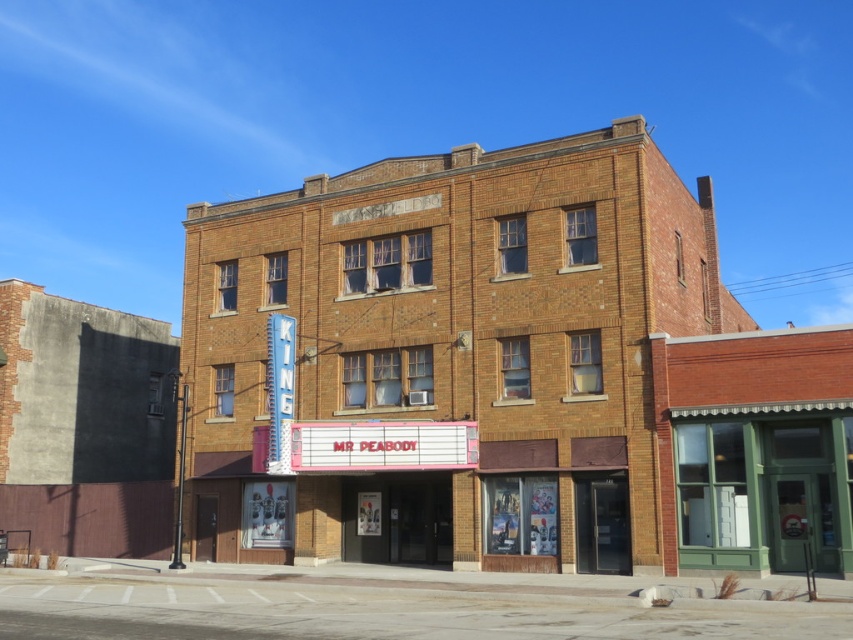
You are a delivery person trying to park your 10 feet long truck in front of the brown brick theater at center and the green painted wood storefront at center. Is there enough space between them to park your truck without blocking either of them?

The brown brick theater at center and green painted wood storefront at center are 15.24 feet apart from each other. Since the truck is 10 feet long, there is sufficient space between them to park the truck without blocking either structure.

You are standing in front of the brown brick theater at center. Where is the theater located in the image?

The brown brick theater at center is located at the point with coordinates (503, 374) in the image.

You are standing in front of a building complex that has two structures. You see the brown brick theater at center and the green painted wood storefront at center. Which structure would cast a longer shadow at noon when the sun is directly overhead?

The brown brick theater at center is taller than the green painted wood storefront at center, so it would cast a longer shadow at noon when the sun is directly overhead.